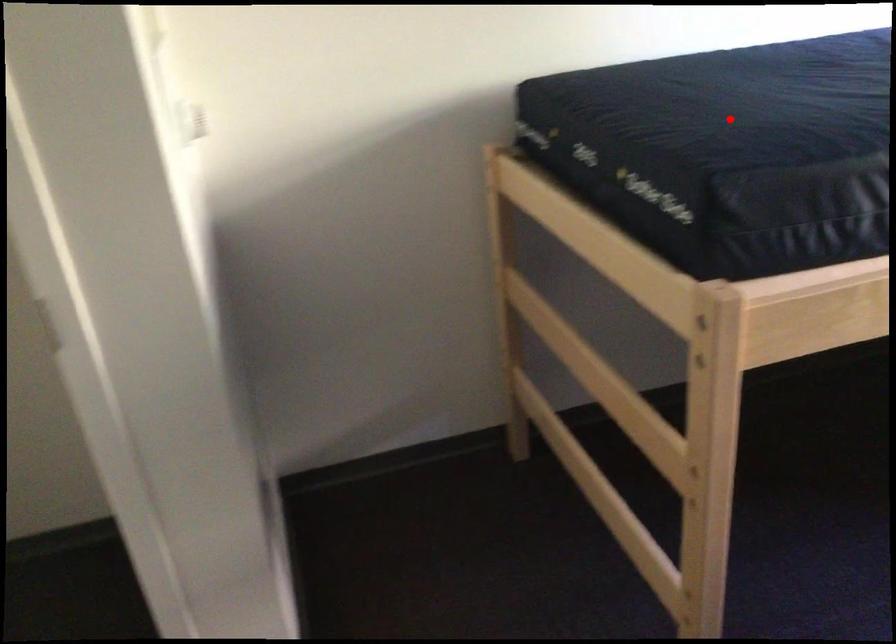
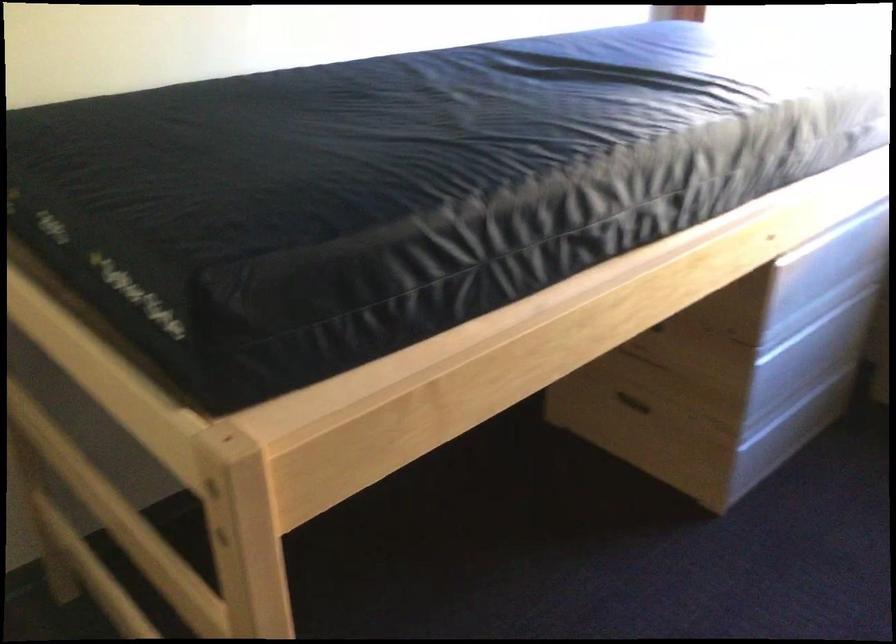
Where in the second image is the point corresponding to the highlighted location from the first image?

(237, 183)